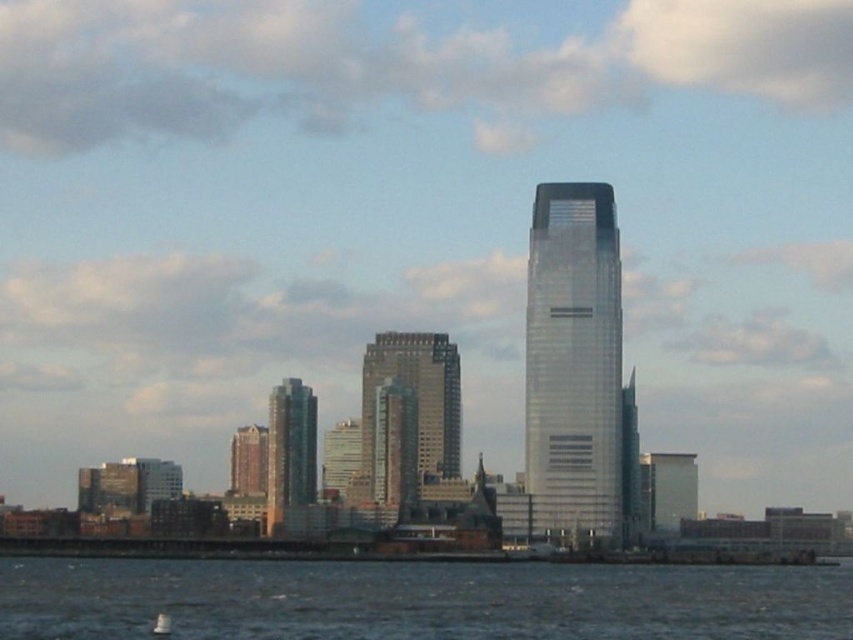
You are a photographer standing on the shore of the cityscape scene. You notice two points marked in the image. The first point is at coordinate point (753, 632) and the second is at point (160, 625). If you want to focus your camera on the point that is closer to you, which coordinate should you aim for?

Point (160, 625) is closer to you than point (753, 632), so you should aim for point (160, 625) to focus on the closer point.

You are a drone operator tasked with flying a drone between two skyscrapers in the cityscape. The drone has a maximum flight distance of 20 meters. Can you safely fly the drone between the silver glass skyscraper at center and the smooth glass skyscraper at center without exceeding its range?

The silver glass skyscraper at center and smooth glass skyscraper at center are 22.79 meters apart from each other. Since the drone has a maximum flight distance of 20 meters, it cannot safely fly between them without exceeding its range.

You are a drone operator tasked with capturing aerial footage of the city. Your drone is currently hovering at the point marked by the coordinates point (x=416, y=396). Based on the scene, what type of building are you directly above?

The point (x=416, y=396) indicates a gray glass building at center, so you are directly above a gray glass building at center.